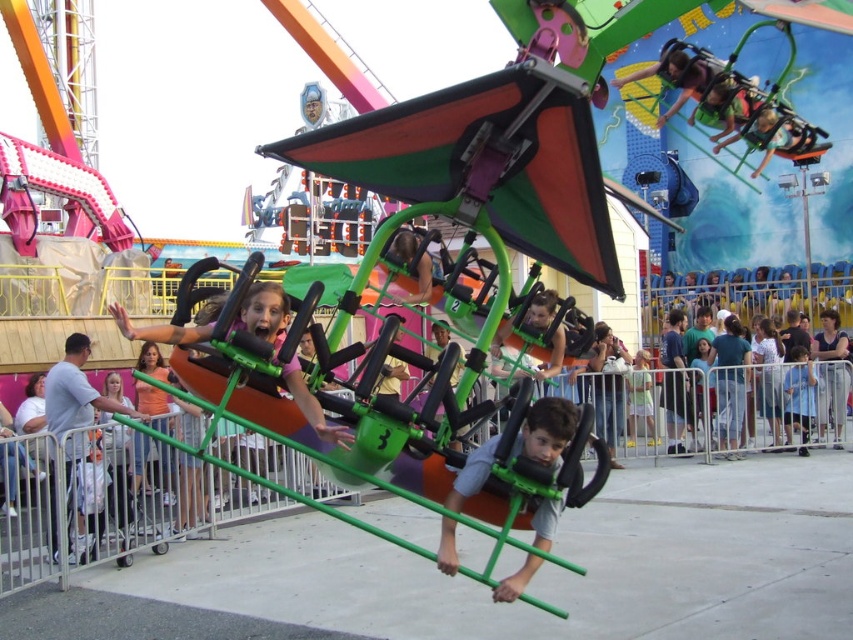
Does light blue shirt at left appear on the left side of blue fabric shirt at lower right?

Yes, light blue shirt at left is to the left of blue fabric shirt at lower right.

Does light blue shirt at left come in front of blue fabric shirt at lower right?

Yes, light blue shirt at left is in front of blue fabric shirt at lower right.

Who is more forward, (82, 346) or (801, 376)?

Positioned in front is point (82, 346).

The width and height of the screenshot is (853, 640). I want to click on light blue shirt at left, so click(74, 390).

Which of these two, gray fabric shirt at center or blue fabric shirt at lower right, stands shorter?

With less height is blue fabric shirt at lower right.

Which of these two, gray fabric shirt at center or blue fabric shirt at lower right, stands taller?

With more height is gray fabric shirt at center.

Is point (535, 417) closer to camera compared to point (787, 438)?

That is True.

This screenshot has width=853, height=640. What are the coordinates of `gray fabric shirt at center` in the screenshot? It's located at [546, 429].

Which is below, gray fabric shirt at center or light blue shirt at left?

gray fabric shirt at center

Can you confirm if gray fabric shirt at center is smaller than light blue shirt at left?

Indeed, gray fabric shirt at center has a smaller size compared to light blue shirt at left.

Is point (480, 474) positioned in front of point (115, 406)?

Yes.

You are a GUI agent. You are given a task and a screenshot of the screen. Output one action in this format:
    pyautogui.click(x=<x>, y=<y>)
    Task: Click on the gray fabric shirt at center
    
    Given the screenshot: What is the action you would take?
    pyautogui.click(x=546, y=429)